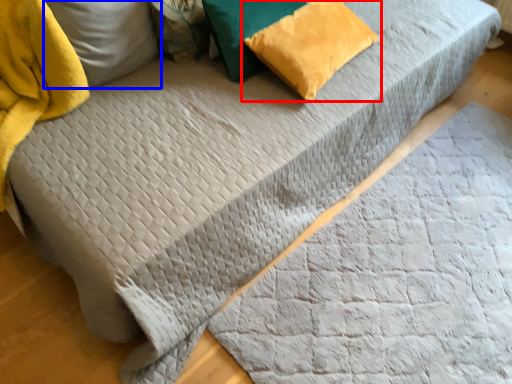
Question: Which of the following is the closest to the observer, pillow (highlighted by a red box) or pillow (highlighted by a blue box)?

Choices:
 (A) pillow
 (B) pillow

Answer: (B)